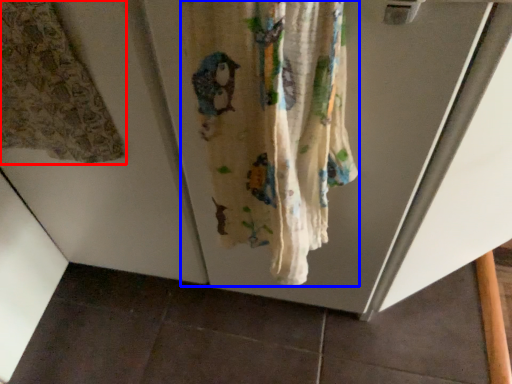
Question: Which object appears closest to the camera in this image, curtain (highlighted by a red box) or curtain (highlighted by a blue box)?

Choices:
 (A) curtain
 (B) curtain

Answer: (B)